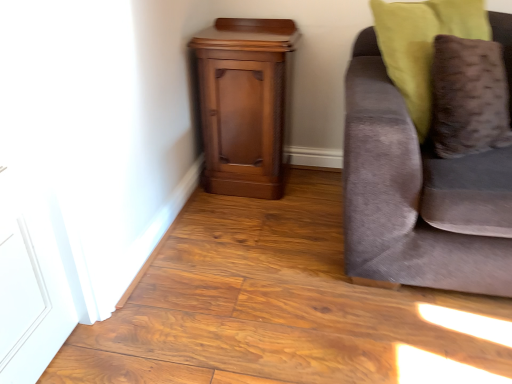
The image size is (512, 384). Find the location of `free space on the front side of polished wood nightstand at lower left`. free space on the front side of polished wood nightstand at lower left is located at coordinates (247, 225).